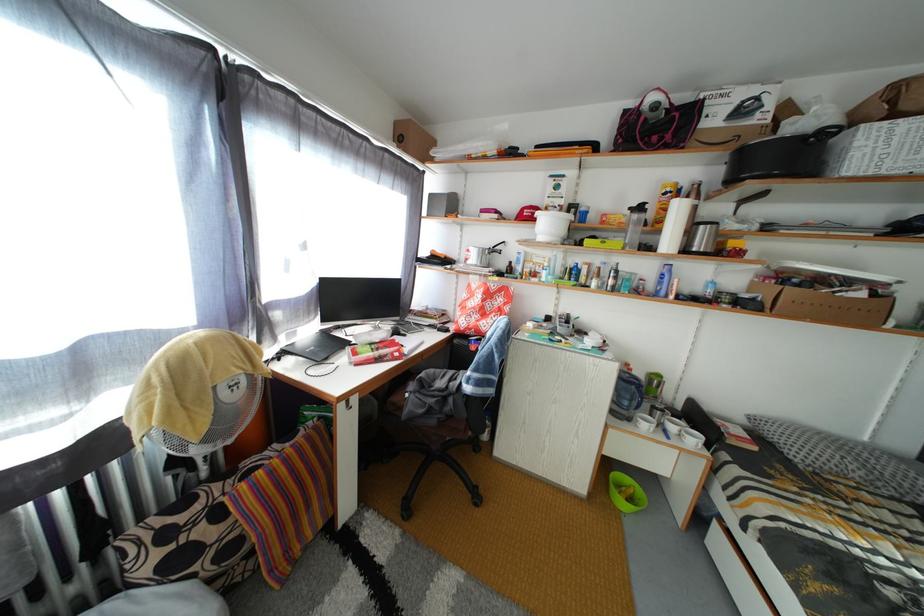
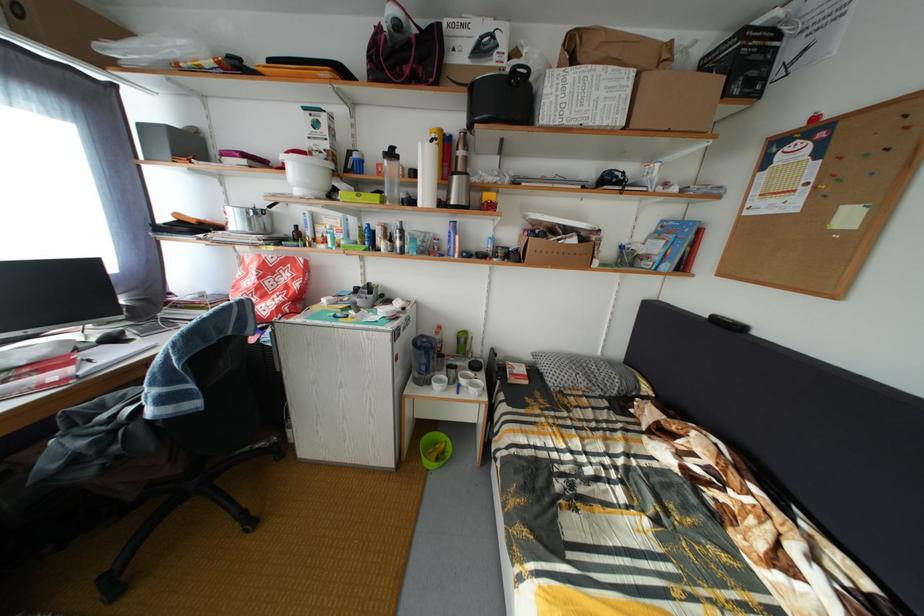
The point at [627,493] is marked in the first image. Where is the corresponding point in the second image?

(444, 451)